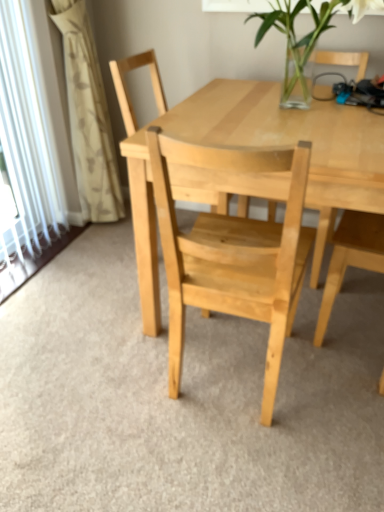
Question: Is white textured curtain at left wider or thinner than natural wood chair at center?

Choices:
 (A) thin
 (B) wide

Answer: (A)

Question: From the image's perspective, is white textured curtain at left positioned above or below natural wood chair at center?

Choices:
 (A) above
 (B) below

Answer: (A)

Question: Which object is positioned farthest from the clear glass vase at upper center?

Choices:
 (A) natural wood chair at center
 (B) natural wood table at center
 (C) white textured curtain at left

Answer: (C)

Question: Which object is the closest to the natural wood table at center?

Choices:
 (A) clear glass vase at upper center
 (B) white textured curtain at left
 (C) natural wood chair at center

Answer: (A)